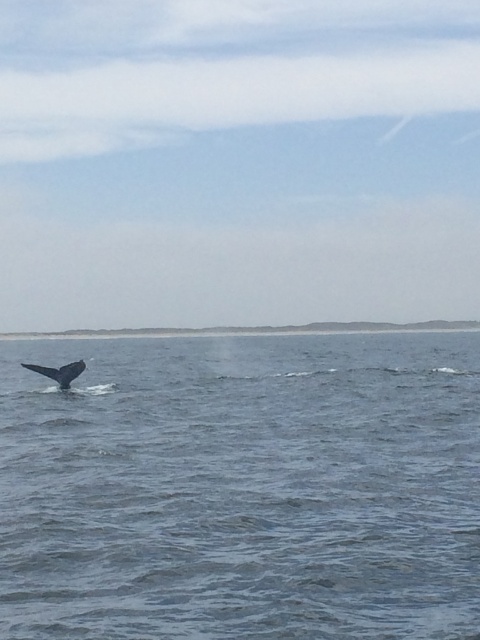
You are a marine biologist observing the seascape. You notice the blue water at lower left and the gray matte whale tail at lower left. Which object occupies more horizontal space in the image?

The blue water at lower left occupies more horizontal space because its width surpasses that of the gray matte whale tail at lower left.

You are a photographer trying to capture the whale tail in the image. You notice two points marked on your screen at coordinates point (263,376) and point (68,371). Which point is closer to the camera?

Point (68,371) is closer to the camera because the Objects Description states that point (263,376) is further to the camera than point (68,371).